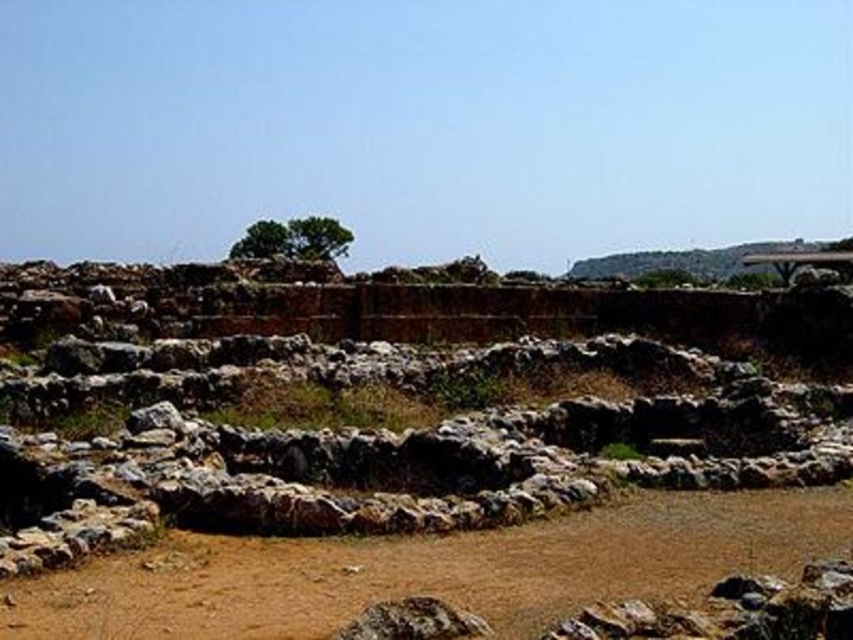
Question: Does brown dirt field at lower center have a smaller size compared to green leafy tree at center?

Choices:
 (A) yes
 (B) no

Answer: (A)

Question: Which of the following is the closest to the observer?

Choices:
 (A) (155, 563)
 (B) (329, 230)

Answer: (A)

Question: Considering the relative positions of brown dirt field at lower center and green leafy tree at center in the image provided, where is brown dirt field at lower center located with respect to green leafy tree at center?

Choices:
 (A) above
 (B) below

Answer: (B)

Question: Which point appears farthest from the camera in this image?

Choices:
 (A) (403, 556)
 (B) (252, 237)

Answer: (B)

Question: Which point is farther to the camera?

Choices:
 (A) green leafy tree at center
 (B) brown dirt field at lower center

Answer: (A)

Question: Can you confirm if brown dirt field at lower center is positioned to the right of green leafy tree at center?

Choices:
 (A) yes
 (B) no

Answer: (A)